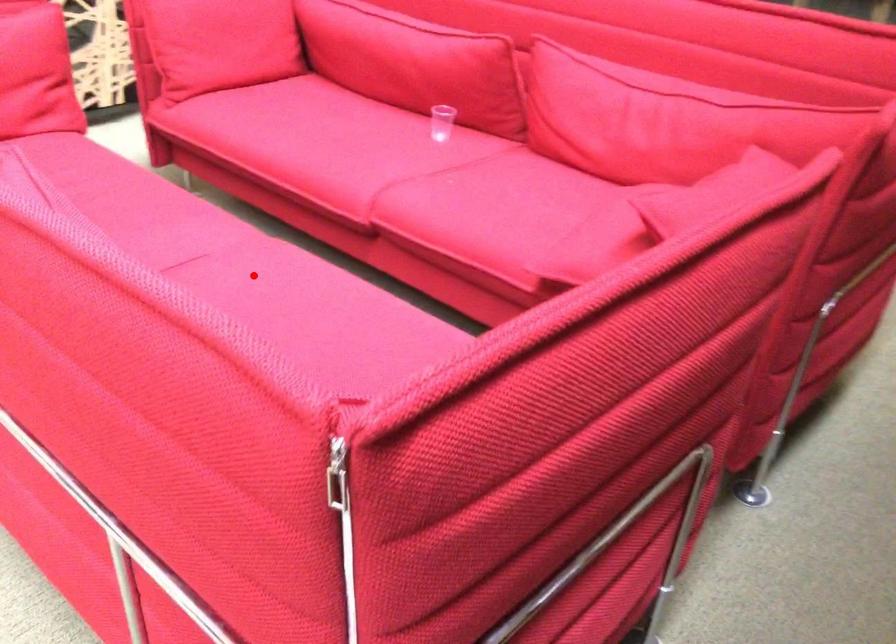
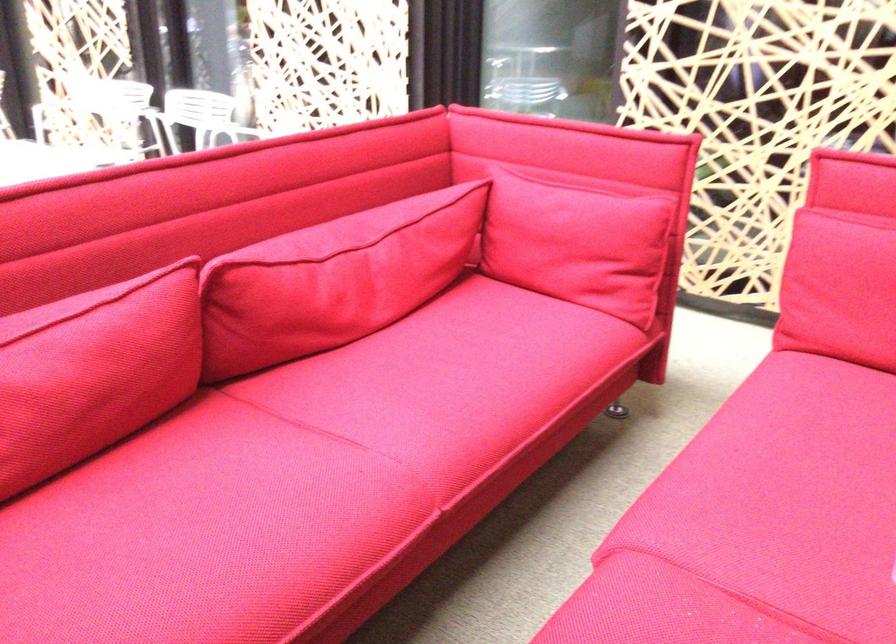
Question: I am providing you with two images of the same scene from different viewpoints. Given a red point in image1, look at the same physical point in image2. Is it:

Choices:
 (A) Closer to the viewpoint
 (B) Farther from the viewpoint

Answer: (A)